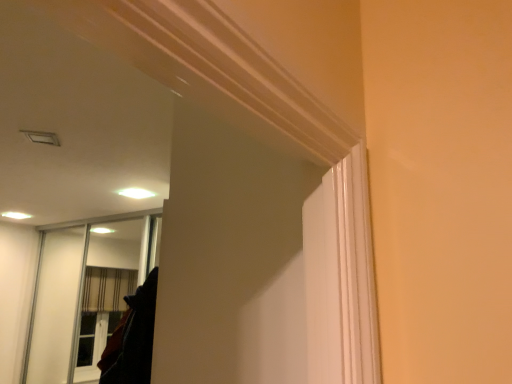
The image size is (512, 384). Describe the element at coordinates (132, 339) in the screenshot. I see `dark fabric coat at lower left` at that location.

The image size is (512, 384). In order to click on dark fabric coat at lower left in this screenshot , I will do `click(132, 339)`.

At what (x,y) coordinates should I click in order to perform the action: click on dark fabric coat at lower left. Please return your answer as a coordinate pair (x, y). The height and width of the screenshot is (384, 512). Looking at the image, I should click on (132, 339).